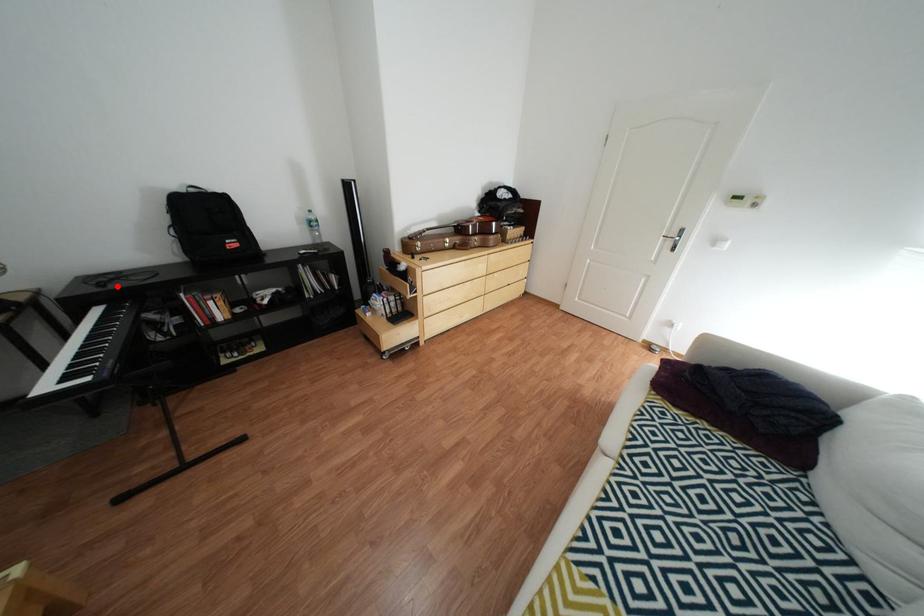
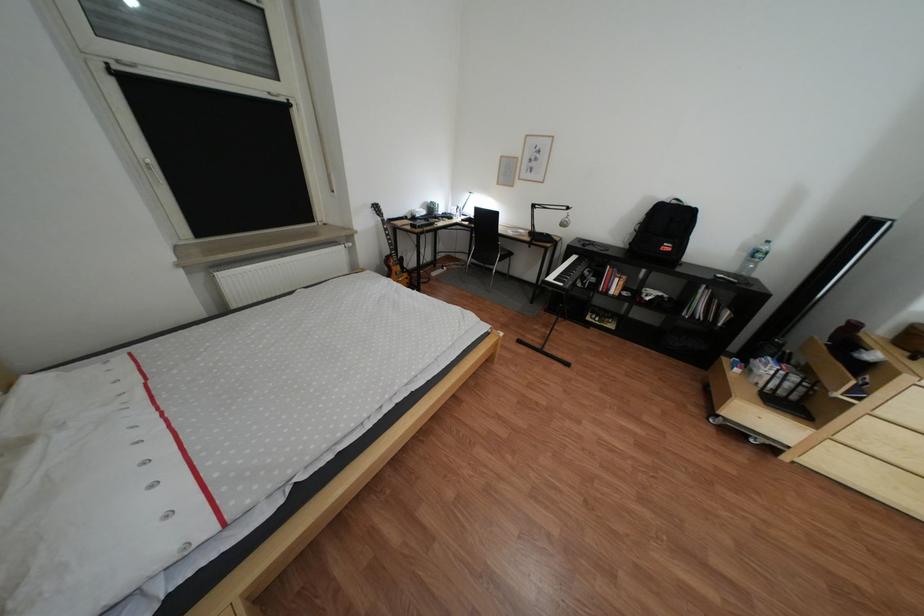
Find the pixel in the second image that matches the highlighted location in the first image.

(600, 246)